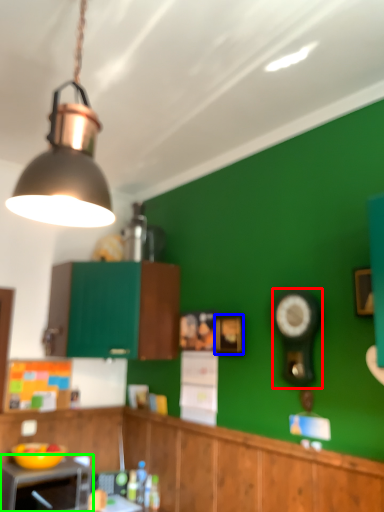
Question: Based on their relative distances, which object is farther from clock (highlighted by a red box)? Choose from picture frame (highlighted by a blue box) and appliance (highlighted by a green box).

Choices:
 (A) picture frame
 (B) appliance

Answer: (B)